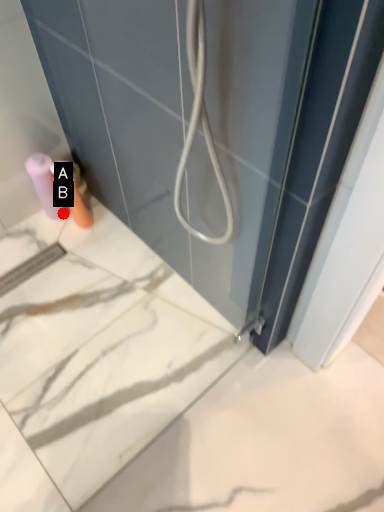
Question: Two points are circled on the image, labeled by A and B beside each circle. Which point is farther to the camera?

Choices:
 (A) A is further
 (B) B is further

Answer: (B)